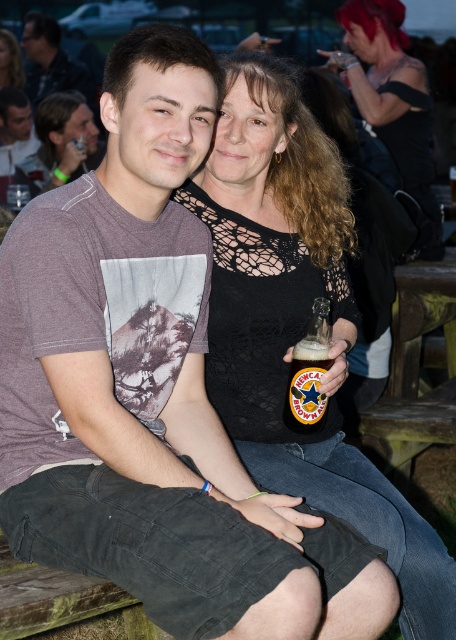
Question: Which point is closer to the camera taking this photo?

Choices:
 (A) 356,67
 (B) 52,67
 (C) 228,182
 (D) 304,369

Answer: (D)

Question: Is the position of matte gray t-shirt at left more distant than that of translucent glass bottle at center?

Choices:
 (A) yes
 (B) no

Answer: (A)

Question: Can you confirm if shiny black hair at upper right is wider than translucent glass bottle at center?

Choices:
 (A) no
 (B) yes

Answer: (B)

Question: Among these objects, which one is farthest from the camera?

Choices:
 (A) translucent glass bottle at center
 (B) shiny black hair at upper right
 (C) matte gray t-shirt at left
 (D) black lace top at center

Answer: (B)

Question: Which of the following is the farthest from the observer?

Choices:
 (A) (247, 99)
 (B) (310, 321)
 (C) (57, 29)

Answer: (C)

Question: From the image, what is the correct spatial relationship of black lace top at center in relation to translucent glass bottle at center?

Choices:
 (A) right
 (B) left

Answer: (A)